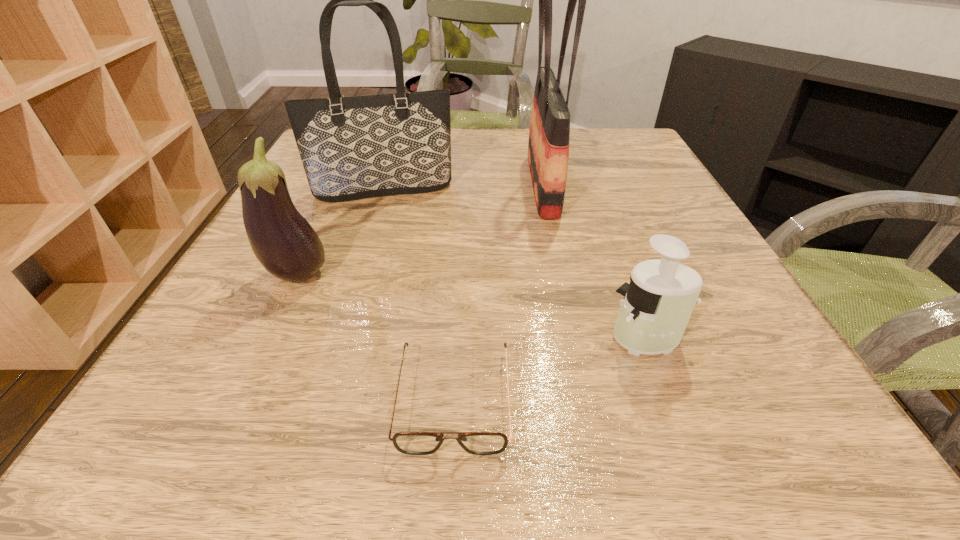
Where is `vacant space that satisfies the following two spatial constraints: 1. on the front-facing side of the fourth object from left to right; 2. on the front-facing side of the shortest object`? The height and width of the screenshot is (540, 960). vacant space that satisfies the following two spatial constraints: 1. on the front-facing side of the fourth object from left to right; 2. on the front-facing side of the shortest object is located at coordinates (588, 398).